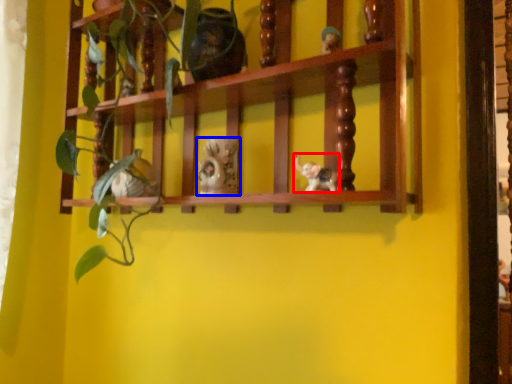
Question: Which object appears farthest to the camera in this image, toy (highlighted by a red box) or toy (highlighted by a blue box)?

Choices:
 (A) toy
 (B) toy

Answer: (B)